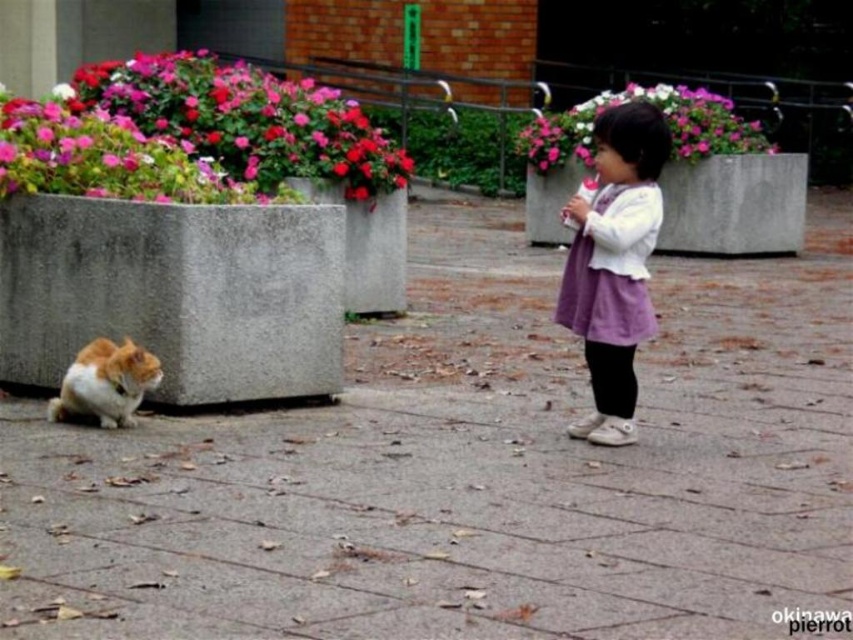
Question: Can you confirm if gray concrete pavement at center is wider than orange and white fur cat at lower left?

Choices:
 (A) yes
 (B) no

Answer: (A)

Question: Which point is farther from the camera taking this photo?

Choices:
 (A) (776, 605)
 (B) (67, 404)

Answer: (B)

Question: Based on their relative distances, which object is nearer to the purple cotton dress at center?

Choices:
 (A) orange and white fur cat at lower left
 (B) gray concrete pavement at center

Answer: (B)

Question: Which of the following is the closest to the observer?

Choices:
 (A) click(x=149, y=388)
 (B) click(x=645, y=140)
 (C) click(x=552, y=637)

Answer: (C)

Question: Can you confirm if gray concrete pavement at center is positioned to the left of purple cotton dress at center?

Choices:
 (A) yes
 (B) no

Answer: (B)

Question: Does gray concrete pavement at center appear under orange and white fur cat at lower left?

Choices:
 (A) no
 (B) yes

Answer: (A)